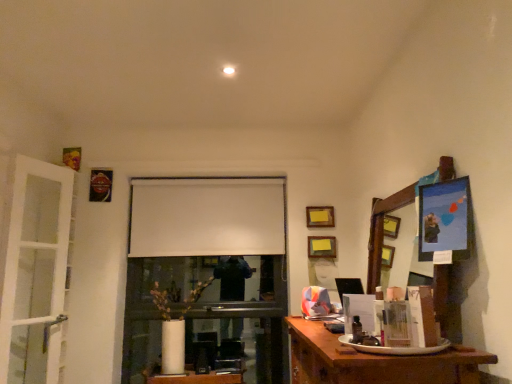
Question: Looking at the image, does wooden desk at lower right seem bigger or smaller compared to white glass door at left?

Choices:
 (A) small
 (B) big

Answer: (B)

Question: Considering the positions of wooden desk at lower right and white glass door at left in the image, is wooden desk at lower right taller or shorter than white glass door at left?

Choices:
 (A) tall
 (B) short

Answer: (B)

Question: Which object is positioned closest to the white matte projection screen at center?

Choices:
 (A) white glass door at left
 (B) wooden picture frame at upper center, marked as the first picture frame in a top-to-bottom arrangement
 (C) yellow matte picture frame at upper center, positioned as the 1th picture frame in bottom-to-top order
 (D) wooden desk at lower right

Answer: (B)

Question: Estimate the real-world distances between objects in this image. Which object is closer to the yellow matte picture frame at upper center, positioned as the 1th picture frame in bottom-to-top order?

Choices:
 (A) white glass door at left
 (B) wooden picture frame at upper center, marked as the first picture frame in a top-to-bottom arrangement
 (C) white matte projection screen at center
 (D) wooden desk at lower right

Answer: (B)